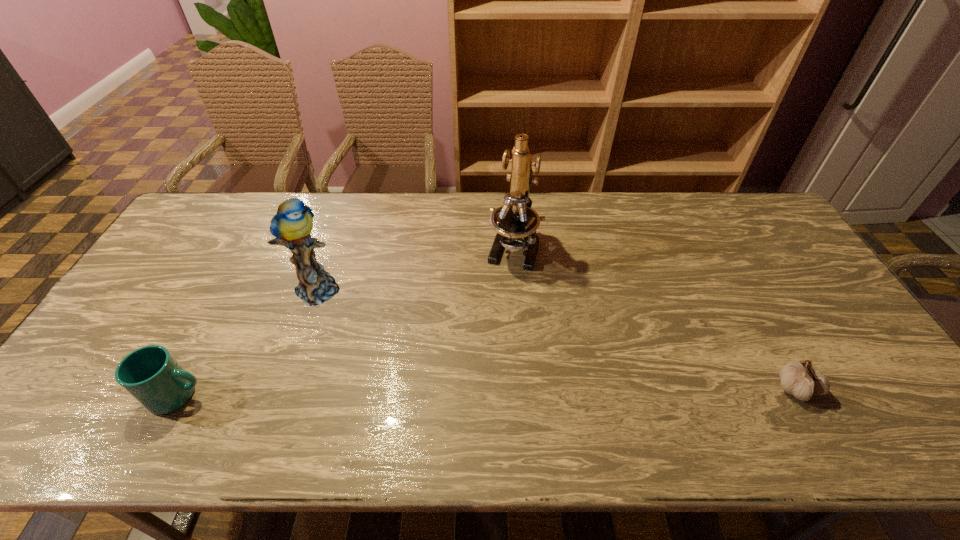
What are the coordinates of `free region at the near left corner of the desktop` in the screenshot? It's located at (84, 388).

You are a GUI agent. You are given a task and a screenshot of the screen. Output one action in this format:
    pyautogui.click(x=<x>, y=<y>)
    Task: Click on the free space at the far right corner
    The width and height of the screenshot is (960, 540).
    Given the screenshot: What is the action you would take?
    pyautogui.click(x=782, y=235)

The width and height of the screenshot is (960, 540). I want to click on vacant space that is in between the rightmost object and the second object from right to left, so click(655, 318).

Find the location of a particular element. This screenshot has width=960, height=540. free space between the rightmost object and the microscope is located at coordinates (655, 318).

This screenshot has width=960, height=540. Find the location of `vacant area that lies between the garlic and the microscope`. vacant area that lies between the garlic and the microscope is located at coordinates (655, 318).

Identify the location of vacant space that's between the second object from left to right and the leftmost object. Image resolution: width=960 pixels, height=540 pixels. (250, 341).

The height and width of the screenshot is (540, 960). I want to click on vacant area between the microscope and the rightmost object, so click(655, 318).

Where is `free space between the rightmost object and the parrot`? This screenshot has width=960, height=540. free space between the rightmost object and the parrot is located at coordinates (558, 337).

Identify the location of free space between the second object from right to left and the rightmost object. (655, 318).

This screenshot has width=960, height=540. I want to click on unoccupied area between the third object from left to right and the leftmost object, so click(x=347, y=321).